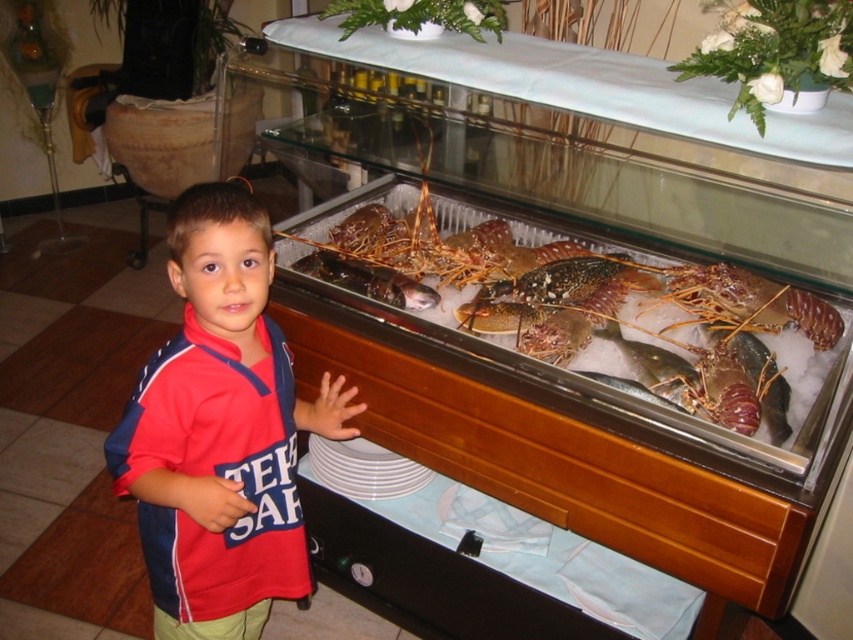
Question: Observing the image, what is the correct spatial positioning of red cotton shirt at center in reference to wooden drawer at lower center?

Choices:
 (A) right
 (B) left

Answer: (B)

Question: Estimate the real-world distances between objects in this image. Which object is closer to the wooden drawer at lower center?

Choices:
 (A) shiny silver fish at center
 (B) shiny brown lobster at center
 (C) red cotton shirt at center

Answer: (B)

Question: Which of the following is the farthest from the observer?

Choices:
 (A) (608, 477)
 (B) (270, 573)
 (C) (508, 298)
 (D) (647, 392)

Answer: (C)

Question: Considering the real-world distances, which object is farthest from the shiny silver fish at center?

Choices:
 (A) shiny brown lobster at center
 (B) wooden drawer at lower center
 (C) red cotton shirt at center

Answer: (C)

Question: Can you confirm if wooden drawer at lower center is bigger than shiny brown lobster at center?

Choices:
 (A) no
 (B) yes

Answer: (A)

Question: Does red cotton shirt at center have a smaller size compared to shiny silver fish at center?

Choices:
 (A) no
 (B) yes

Answer: (A)